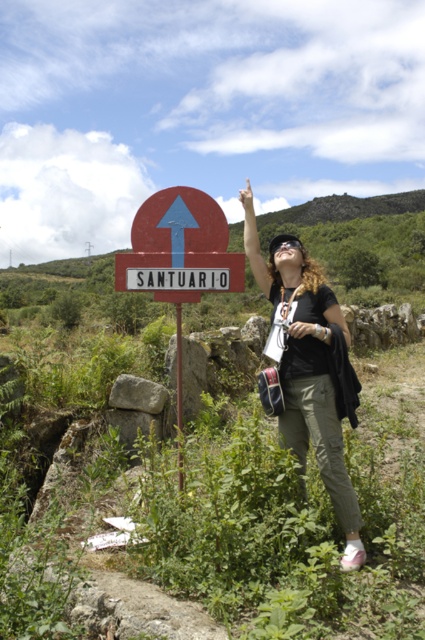
Question: Is red metal sign at upper center thinner than red painted metal signpost at left?

Choices:
 (A) no
 (B) yes

Answer: (A)

Question: Which point is closer to the camera?

Choices:
 (A) (136, 280)
 (B) (289, 236)
 (C) (300, 285)

Answer: (C)

Question: Based on their relative distances, which object is farther from the red metal sign at upper center?

Choices:
 (A) matte black shirt at upper center
 (B) red painted metal signpost at left

Answer: (B)

Question: Is matte black shirt at upper center thinner than red painted metal signpost at left?

Choices:
 (A) yes
 (B) no

Answer: (B)

Question: Which point is farther from the camera taking this photo?

Choices:
 (A) (172, 284)
 (B) (178, 385)
 (C) (331, 304)

Answer: (B)

Question: Observing the image, what is the correct spatial positioning of red painted metal signpost at left in reference to black matte goggles at upper center?

Choices:
 (A) above
 (B) below

Answer: (B)